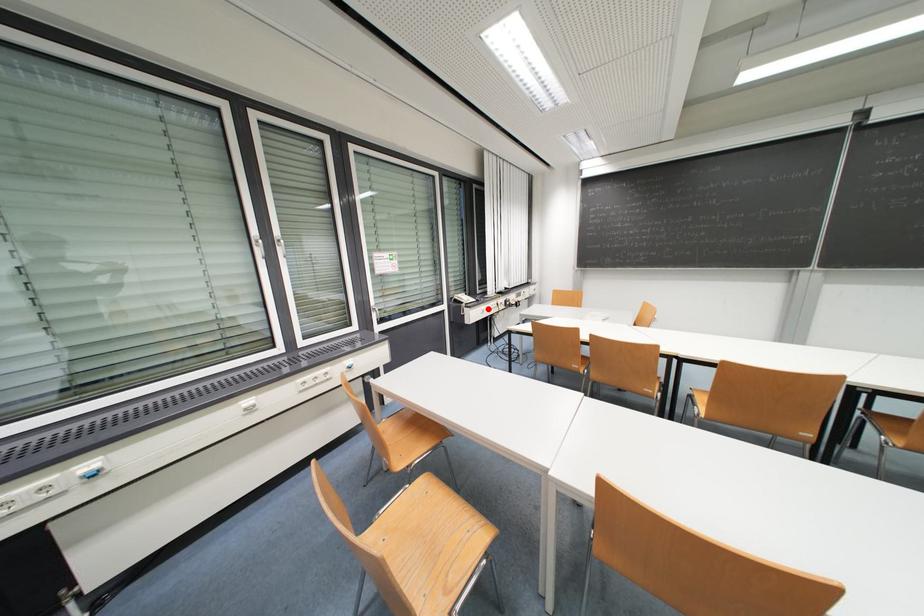
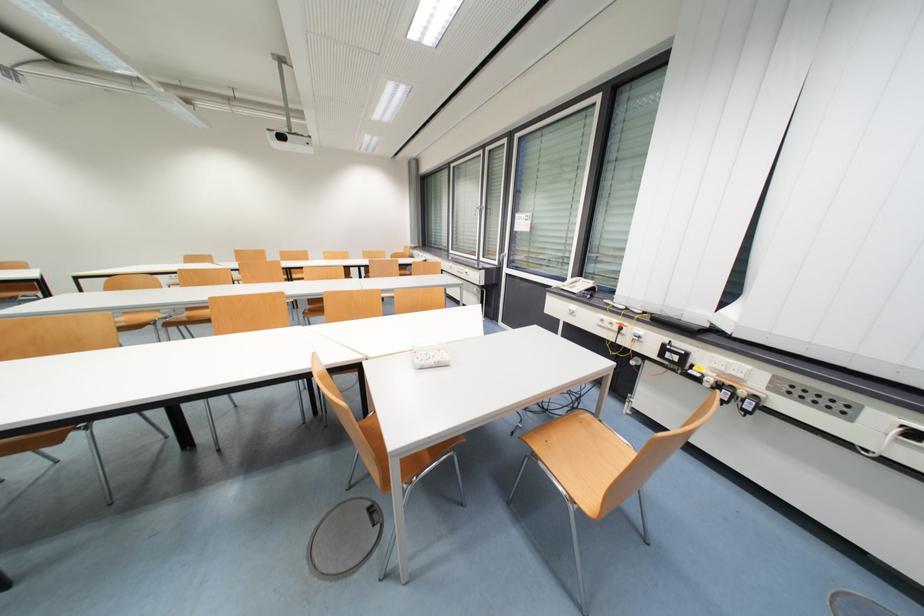
Locate, in the second image, the point that corresponds to the highlighted location in the first image.

(578, 309)